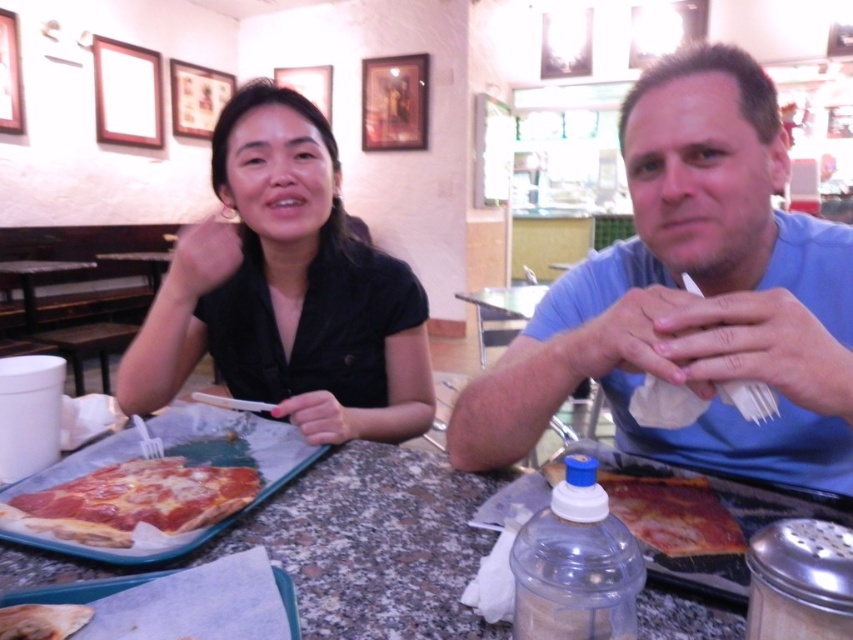
You are sitting at the table in the dining establishment and want to place a small vase between the wooden frame at upper center and the wooden picture frame at upper center. Which frame should you move to make space?

The wooden frame at upper center is closer to you than the wooden picture frame at upper center, so you should move the wooden frame at upper center to make space for the vase.

You are a photographer setting up for a group photo. You need to place a 1.2 meter tall tripod between the granite table at center and the wooden frame at upper center. Based on their heights, will the tripod be visible behind the shorter object?

The granite table at center is shorter than the wooden frame at upper center. Since the tripod is 1.2 meters tall and needs to be placed between them, it will be visible behind the granite table at center because it is the shorter object.

You are a photographer standing at a distance, trying to capture a photo of both the blue cotton shirt at center and the wooden picture frame at upper center in the same shot. Given that your camera has a maximum zoom range of 5 meters, will you be able to include both objects in the frame without moving closer?

The blue cotton shirt at center and wooden picture frame at upper center are 5.16 meters apart from each other. Since the camera can only zoom up to 5 meters, the distance between them exceeds the maximum zoom range. Therefore, you cannot include both objects in the frame without moving closer.